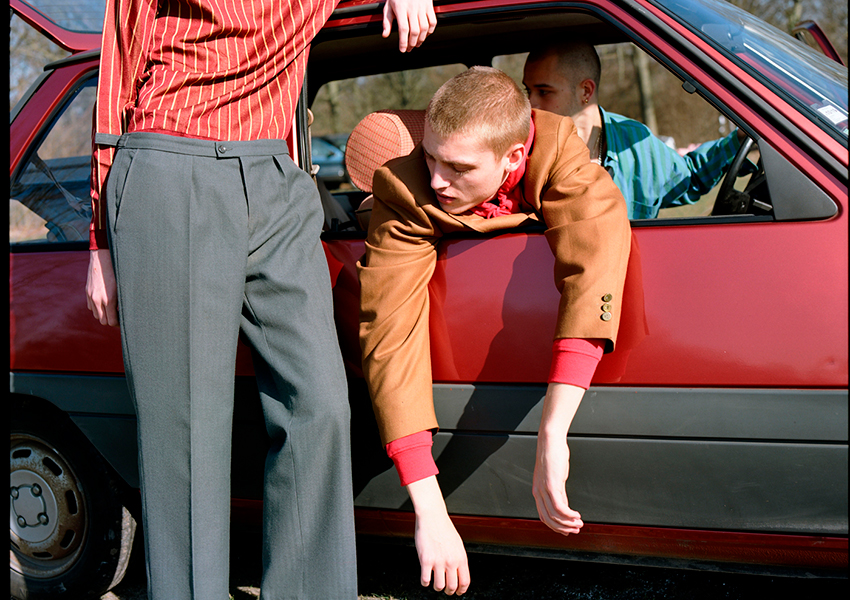
Find the location of a particular element. windows is located at coordinates (785, 63), (69, 167), (89, 7).